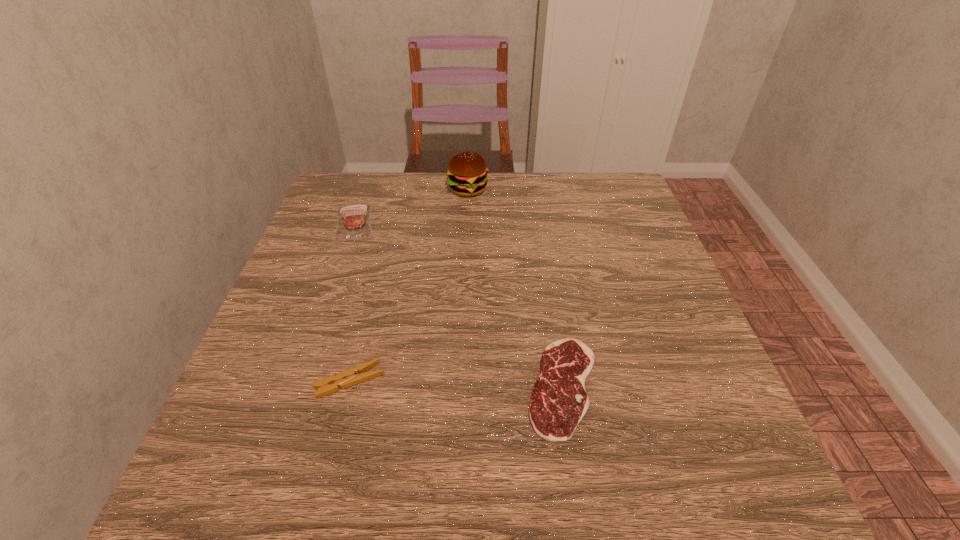
Locate an element on the screen. Image resolution: width=960 pixels, height=540 pixels. free space at the near left corner is located at coordinates (291, 475).

In the image, there is a desktop. Where is `vacant space at the near right corner`? The image size is (960, 540). vacant space at the near right corner is located at coordinates (717, 471).

The height and width of the screenshot is (540, 960). I want to click on free space between the shorter steak and the farthest object, so click(516, 288).

Locate an element on the screen. vacant point located between the third object from left to right and the nearer steak is located at coordinates (516, 288).

Locate an element on the screen. This screenshot has height=540, width=960. blank region between the taller steak and the nearer steak is located at coordinates [x=459, y=305].

Image resolution: width=960 pixels, height=540 pixels. What are the coordinates of `blank region between the shortest object and the clothespin` in the screenshot? It's located at point(457,384).

At what (x,y) coordinates should I click in order to perform the action: click on free spot between the clothespin and the nearer steak. Please return your answer as a coordinate pair (x, y). Looking at the image, I should click on (457, 384).

At what (x,y) coordinates should I click in order to perform the action: click on free point between the farthest object and the right steak. Please return your answer as a coordinate pair (x, y). Looking at the image, I should click on (516, 288).

This screenshot has width=960, height=540. I want to click on free space between the clothespin and the shorter steak, so click(x=457, y=384).

Identify the location of vacant space that is in between the left steak and the second object from right to left. (411, 206).